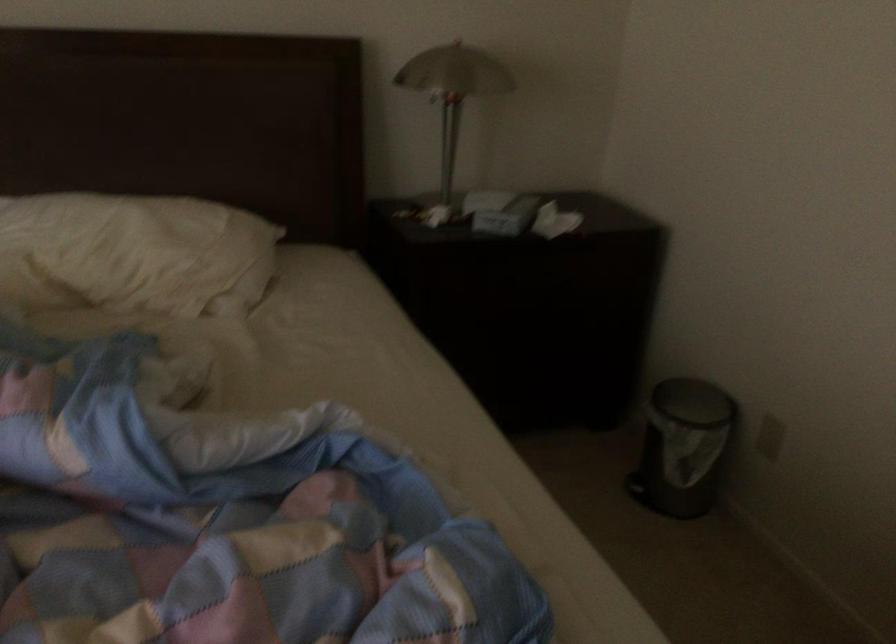
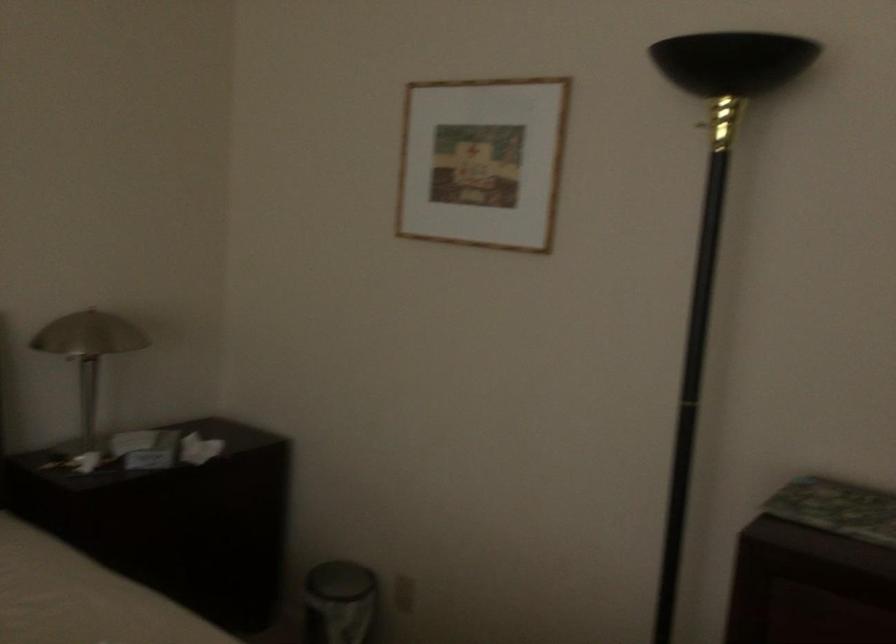
Question: Based on the continuous images, in which direction is the camera rotating? Reply with the corresponding letter.

Choices:
 (A) Left
 (B) Right
 (C) Up
 (D) Down

Answer: (B)